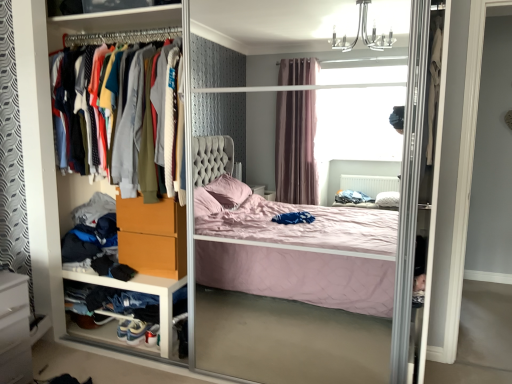
At what (x,y) coordinates should I click in order to perform the action: click on free space that is to the left of white plastic drawer at lower left. Please return your answer as a coordinate pair (x, y). The width and height of the screenshot is (512, 384). Looking at the image, I should click on (69, 350).